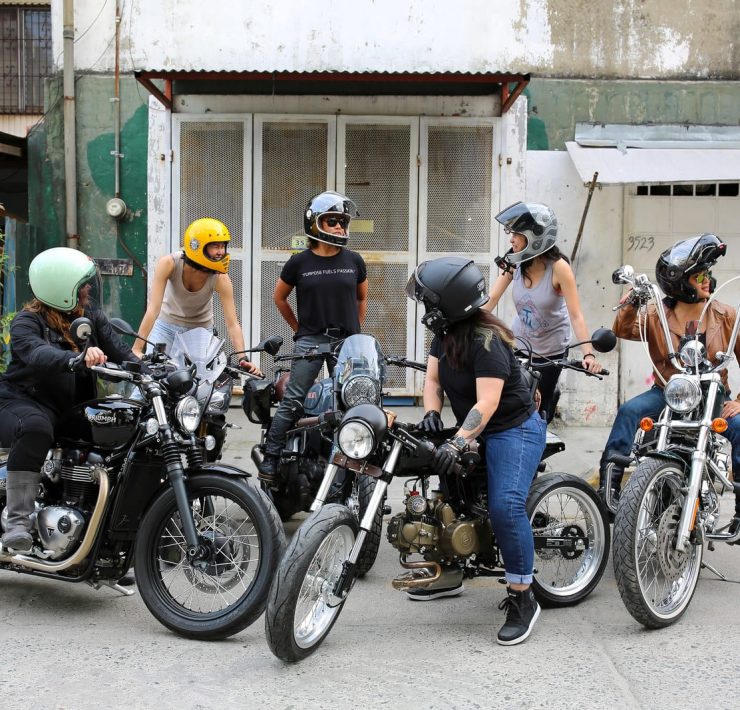
What are the coordinates of `metal doors` in the screenshot? It's located at (212, 146), (289, 163), (383, 160), (454, 162).